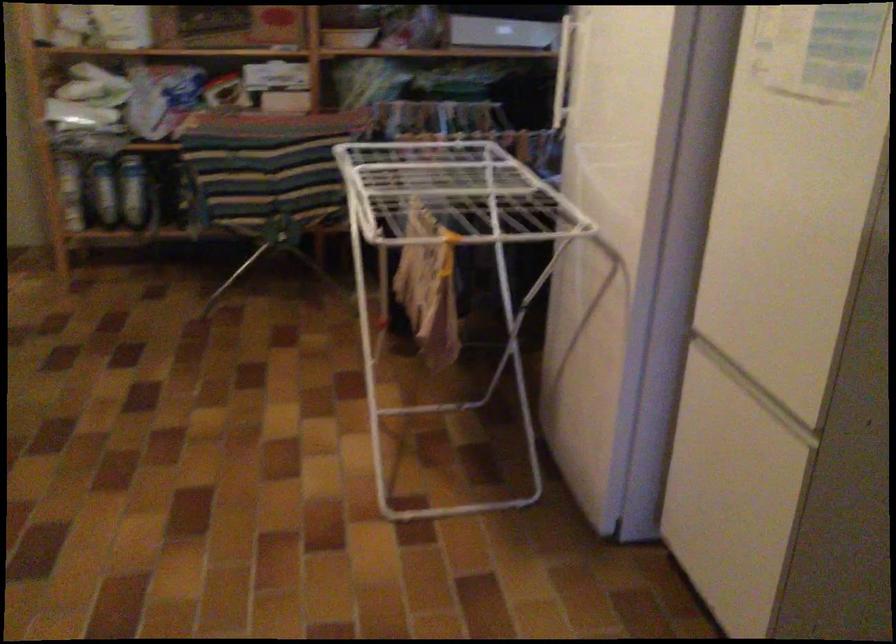
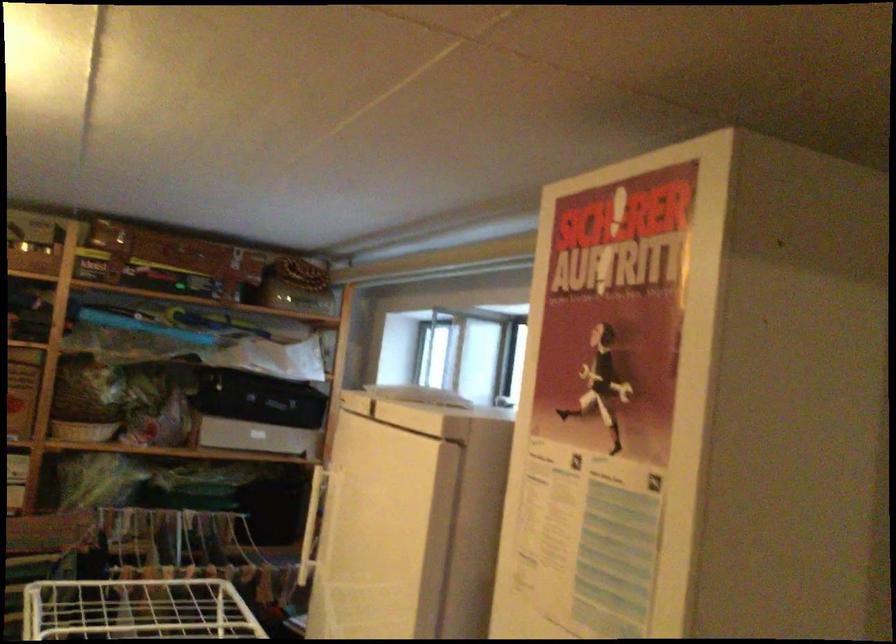
The images are taken continuously from a first-person perspective. In which direction are you moving?

The cameraman moved toward right, forward.